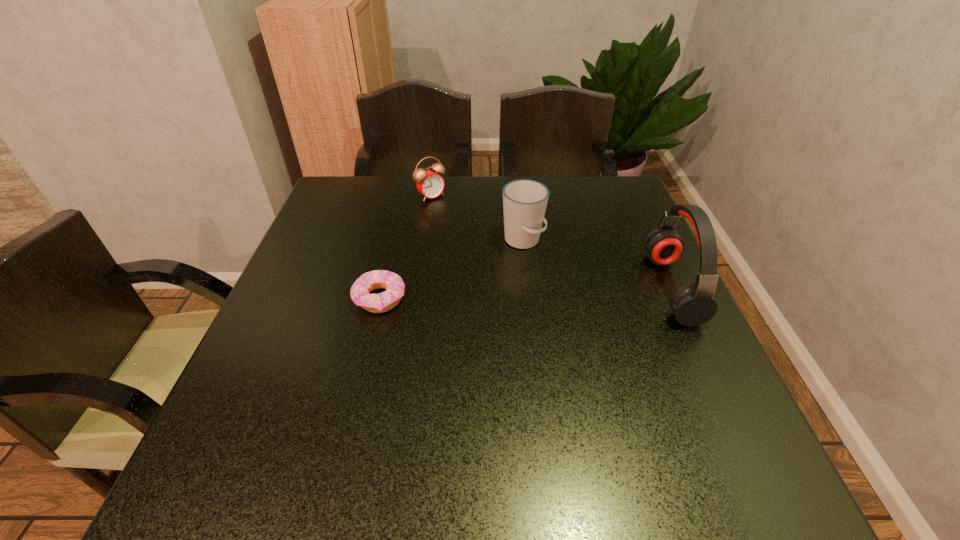
Identify the location of vacant point located between the rightmost object and the alarm clock. Image resolution: width=960 pixels, height=540 pixels. (551, 242).

Find the location of a particular element. The image size is (960, 540). blank region between the rightmost object and the cup is located at coordinates (597, 265).

Identify the location of vacant area between the doughnut and the second object from right to left. (451, 269).

Find the location of a particular element. This screenshot has height=540, width=960. vacant space in between the earphone and the second object from right to left is located at coordinates (597, 265).

The height and width of the screenshot is (540, 960). In order to click on free area in between the earphone and the farthest object in this screenshot , I will do `click(551, 242)`.

Where is `free point between the third shortest object and the shortest object`? The width and height of the screenshot is (960, 540). free point between the third shortest object and the shortest object is located at coordinates (451, 269).

Where is `free space that is in between the tallest object and the second object from right to left`? This screenshot has width=960, height=540. free space that is in between the tallest object and the second object from right to left is located at coordinates (597, 265).

Locate an element on the screen. free area in between the third object from left to right and the farthest object is located at coordinates [476, 219].

In order to click on free space between the doughnut and the earphone in this screenshot , I will do `click(526, 293)`.

Find the location of `blank region between the earphone and the third tallest object`. blank region between the earphone and the third tallest object is located at coordinates (551, 242).